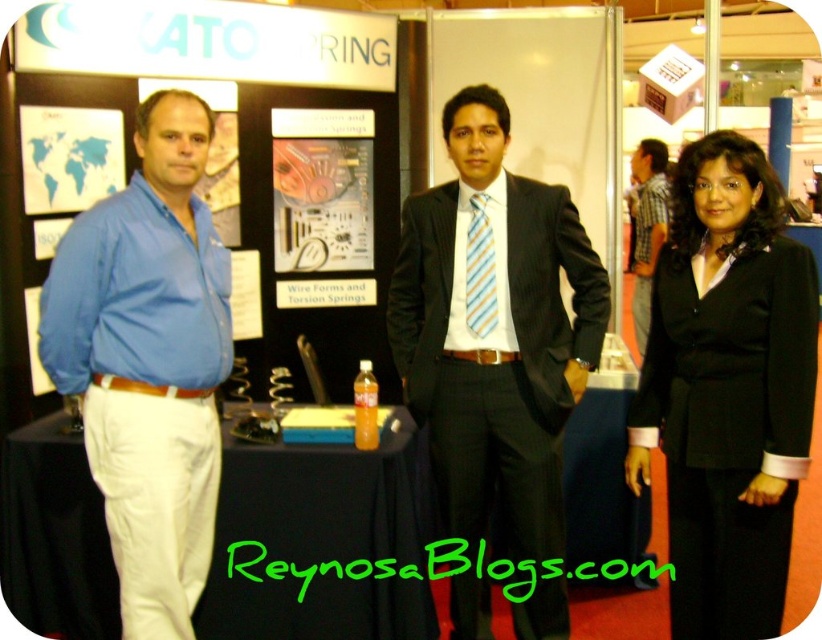
What is the exact location of the black satin blazer at center in the image?

The black satin blazer at center is located at point [727,388].

You are standing at the trade show booth and need to locate two specific points marked on the backdrop. The first point is at coordinates point [158,157] and the second is at point [631,205]. Which of these points is closer to the bottom edge of the backdrop?

Point [158,157] is closer to the bottom edge of the backdrop because it has a smaller y coordinate than point [631,205].